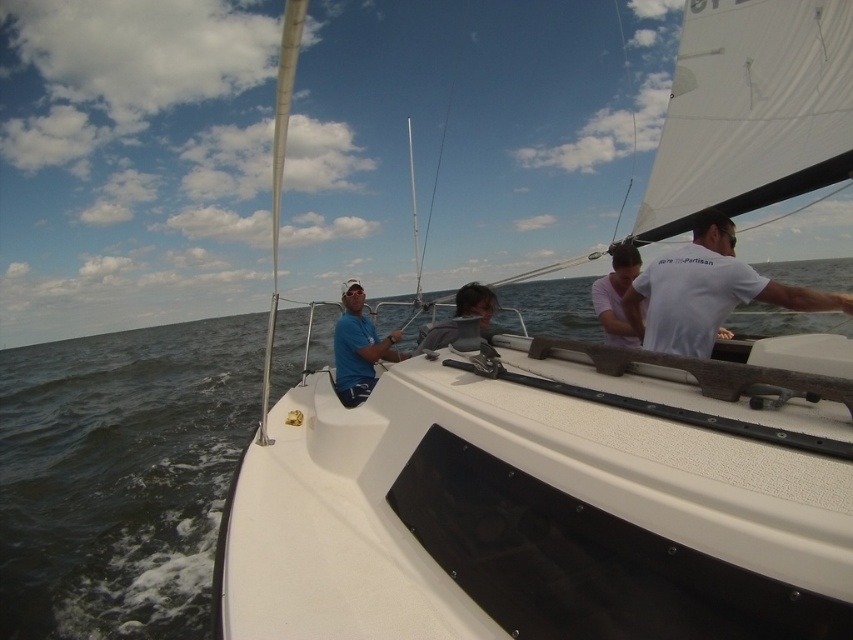
Consider the image. You are a passenger on the sailboat and want to retrieve your sunglasses that fell into the water. The sunglasses are floating near the dark blue water at center. Can you reach them from your current position near the white cotton shirt at right without moving your feet?

The dark blue water at center is located below white cotton shirt at right, so you can reach the sunglasses by leaning over the edge near the white cotton shirt at right.

You are a sailor on the boat and need to locate the white cotton shirt at right. According to the coordinates provided, where would you find it?

The white cotton shirt at right is located at coordinates point (x=706, y=291).